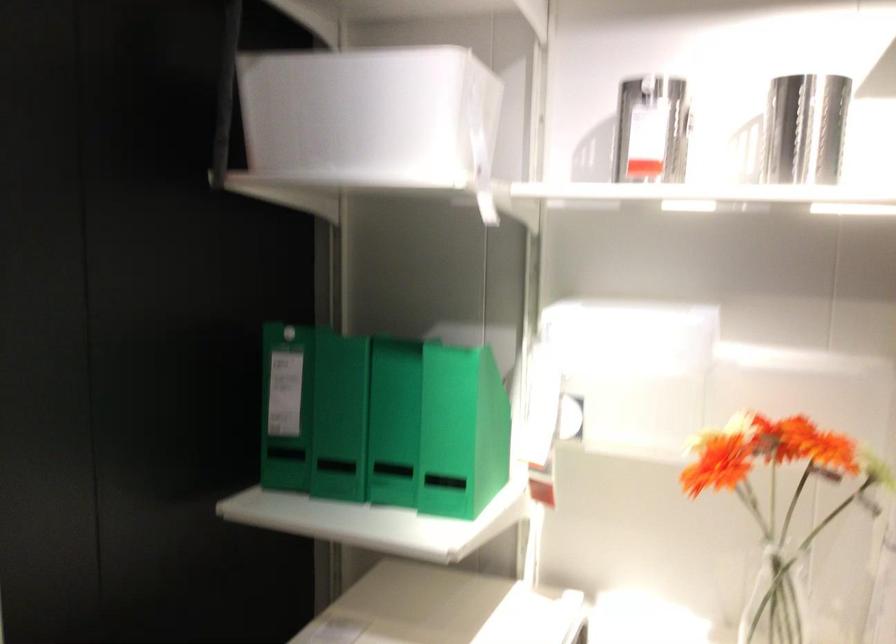
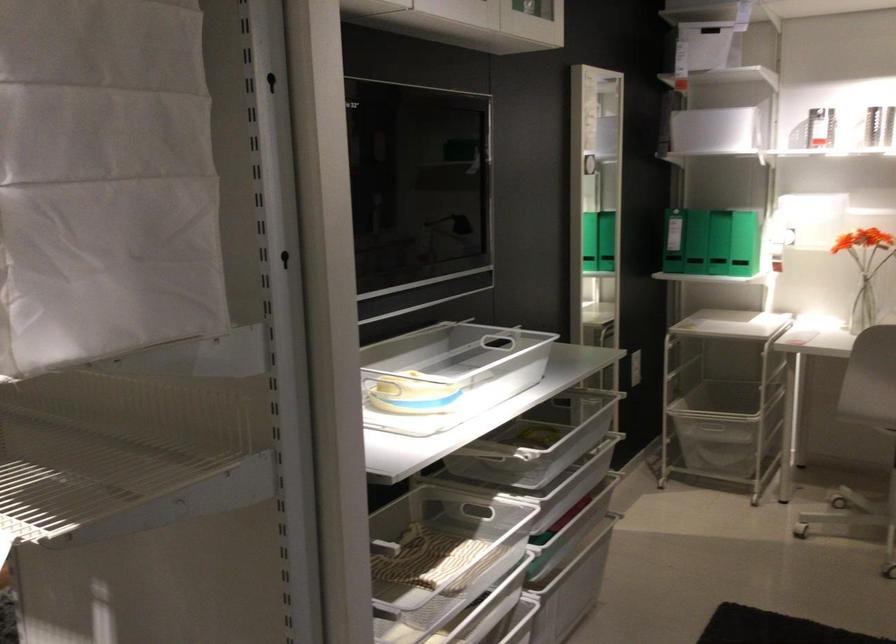
Locate, in the second image, the point that corresponds to pixel 233 440 in the first image.

(673, 241)